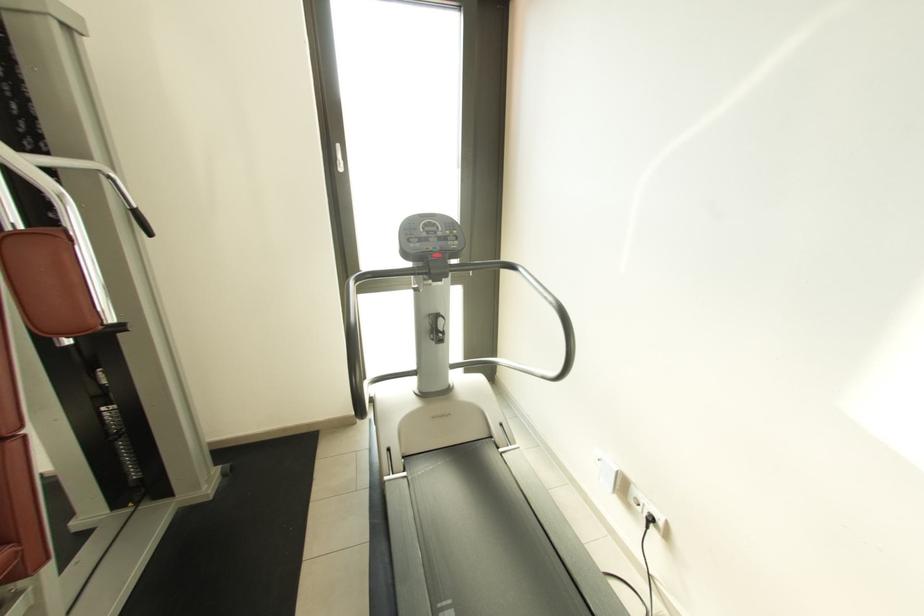
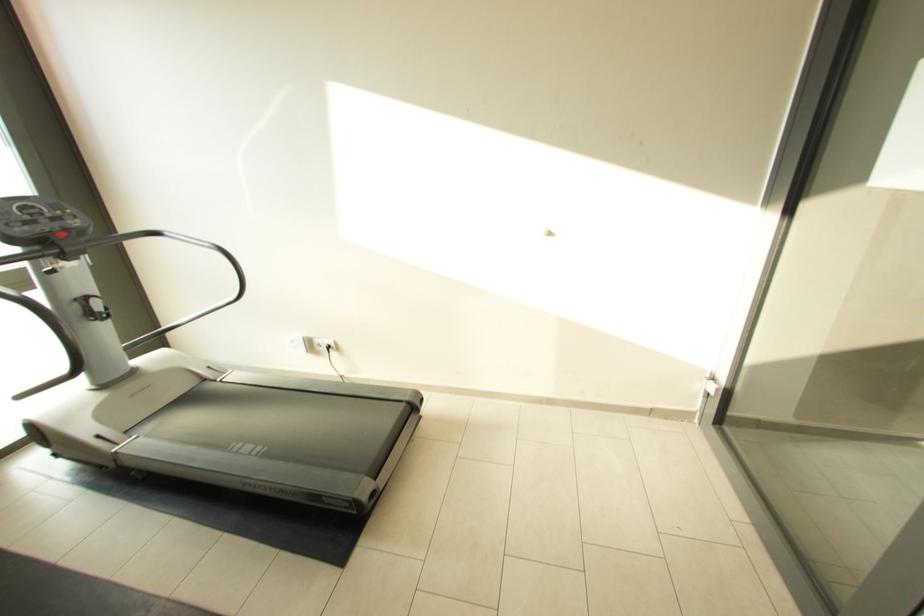
Locate, in the second image, the point that corresponds to point (435, 251) in the first image.

(54, 232)